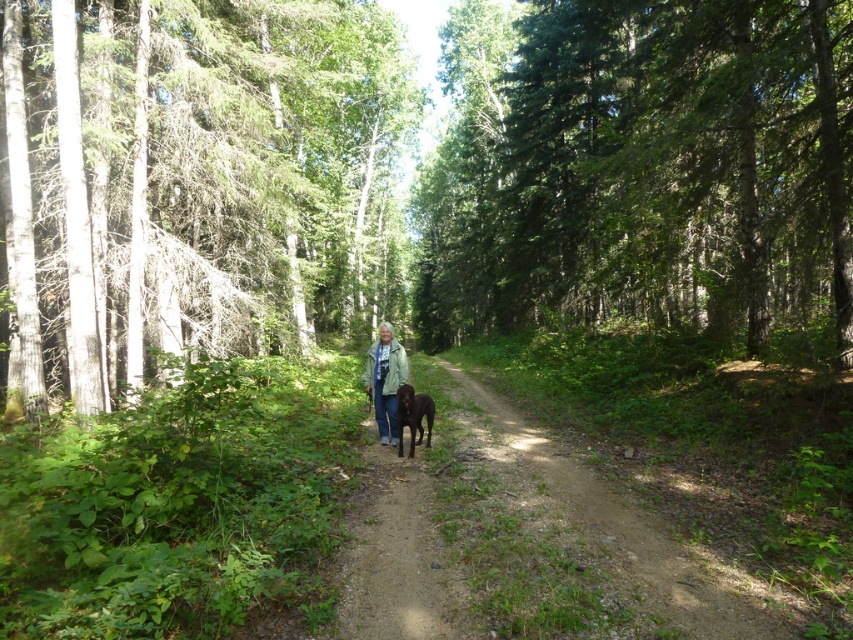
Who is more forward, (378,397) or (415,435)?

Point (415,435) is more forward.

Which is more to the right, green textured jacket at center or shiny brown fur at center?

From the viewer's perspective, shiny brown fur at center appears more on the right side.

Looking at this image, measure the distance between green textured jacket at center and camera.

green textured jacket at center and camera are 9.57 meters apart from each other.

Image resolution: width=853 pixels, height=640 pixels. Identify the location of green textured jacket at center. (386, 380).

Can you confirm if smooth bark tree at center is thinner than green leafy tree at center?

Yes.

Which is behind, point (207, 240) or point (698, 54)?

The point (207, 240) is behind.

Locate an element on the screen. The image size is (853, 640). smooth bark tree at center is located at coordinates (194, 180).

Who is higher up, green leafy tree at center or green textured jacket at center?

green leafy tree at center

At what (x,y) coordinates should I click in order to perform the action: click on green leafy tree at center. Please return your answer as a coordinate pair (x, y). Looking at the image, I should click on (641, 166).

This screenshot has width=853, height=640. Describe the element at coordinates (641, 166) in the screenshot. I see `green leafy tree at center` at that location.

Locate an element on the screen. The width and height of the screenshot is (853, 640). green leafy tree at center is located at coordinates (641, 166).